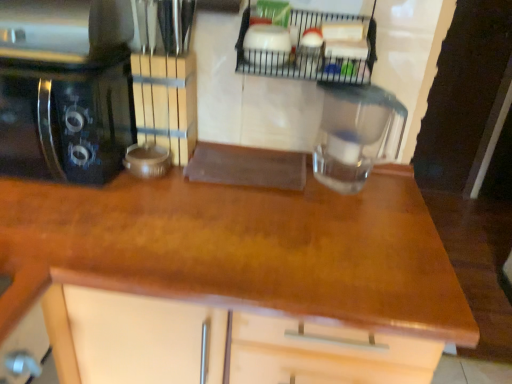
Locate an element on the screen. free spot below transparent glass jar at center (from a real-world perspective) is located at coordinates (348, 186).